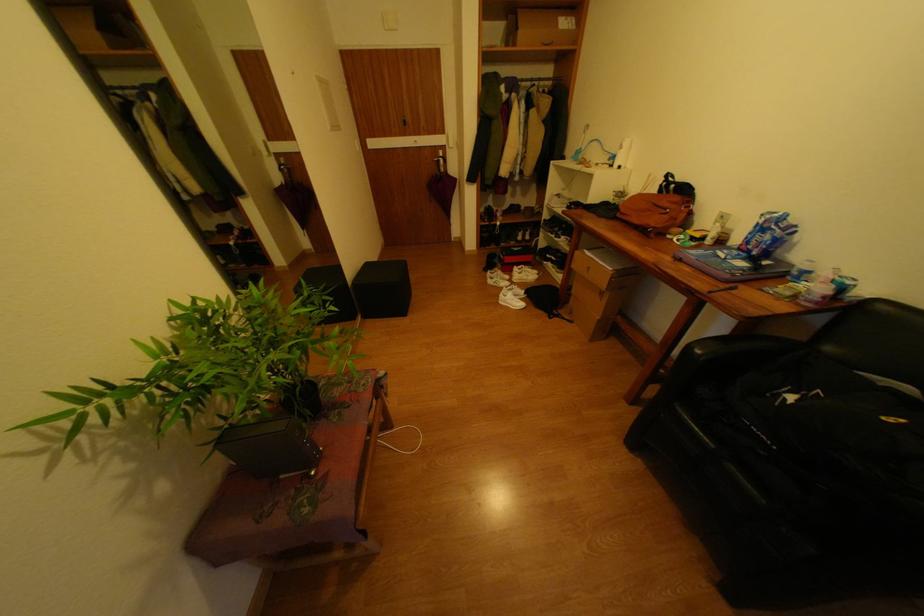
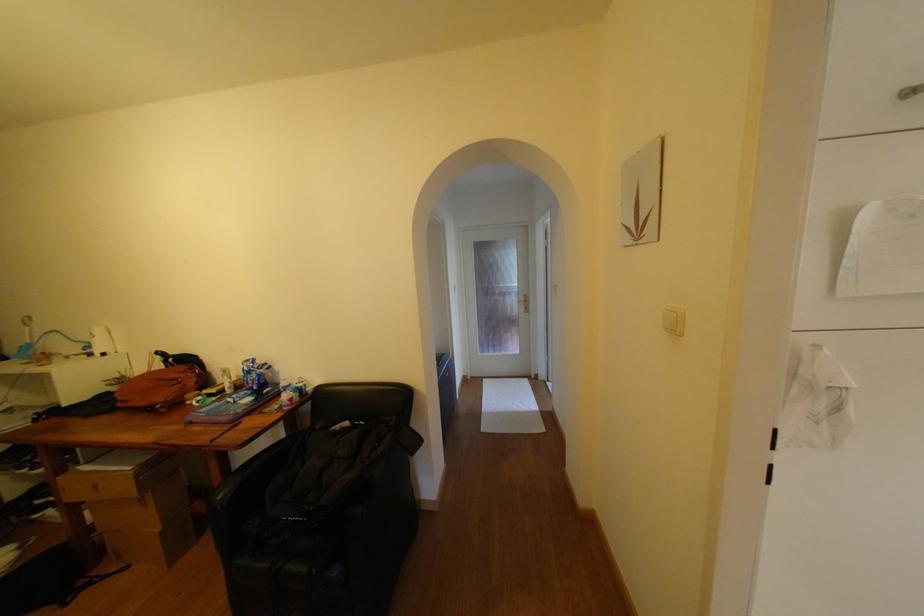
Question: Based on the continuous images, in which direction is the camera rotating? Reply with the corresponding letter.

Choices:
 (A) Left
 (B) Right
 (C) Up
 (D) Down

Answer: (B)